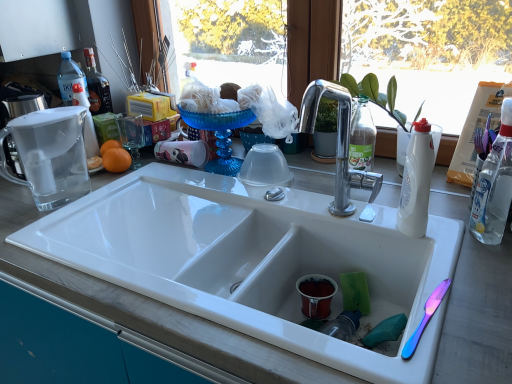
Image resolution: width=512 pixels, height=384 pixels. In order to click on vacant space situated on the left part of white plastic bottle at right, the first bottle in the front-to-back sequence in this screenshot , I will do `click(420, 242)`.